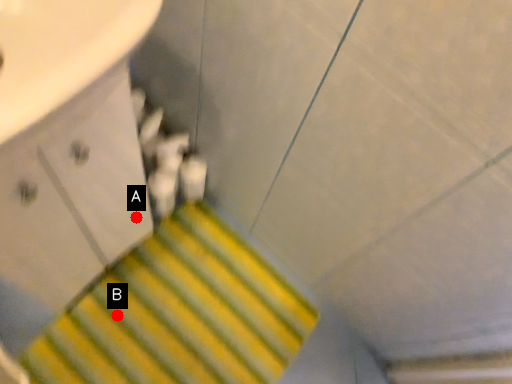
Question: Two points are circled on the image, labeled by A and B beside each circle. Which point is closer to the camera taking this photo?

Choices:
 (A) A is closer
 (B) B is closer

Answer: (A)